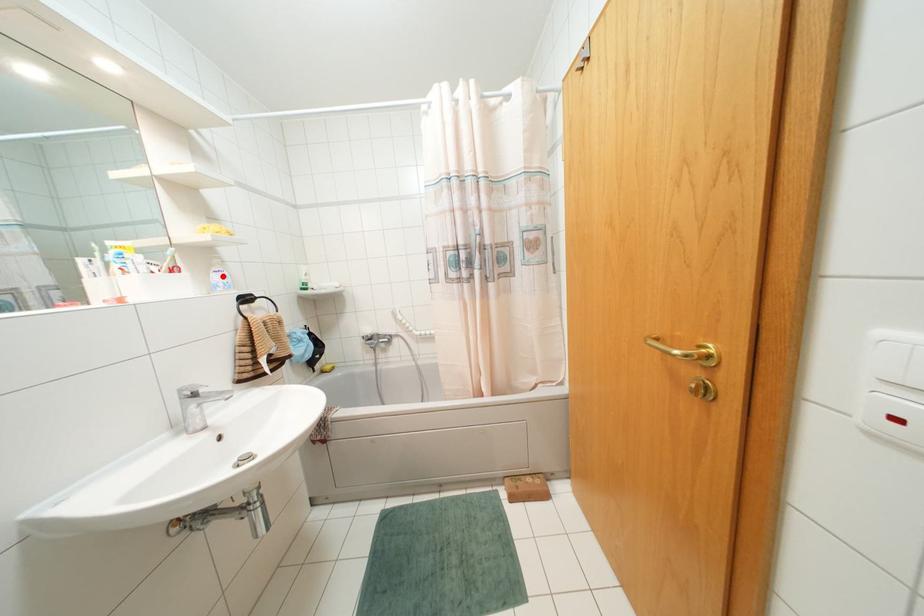
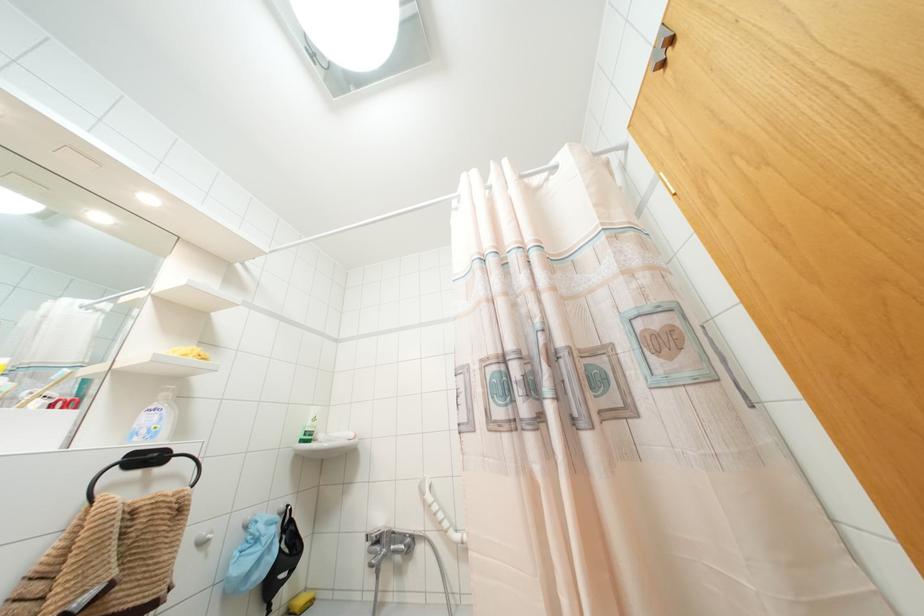
In the second image, find the point that corresponds to the highlighted location in the first image.

(154, 418)